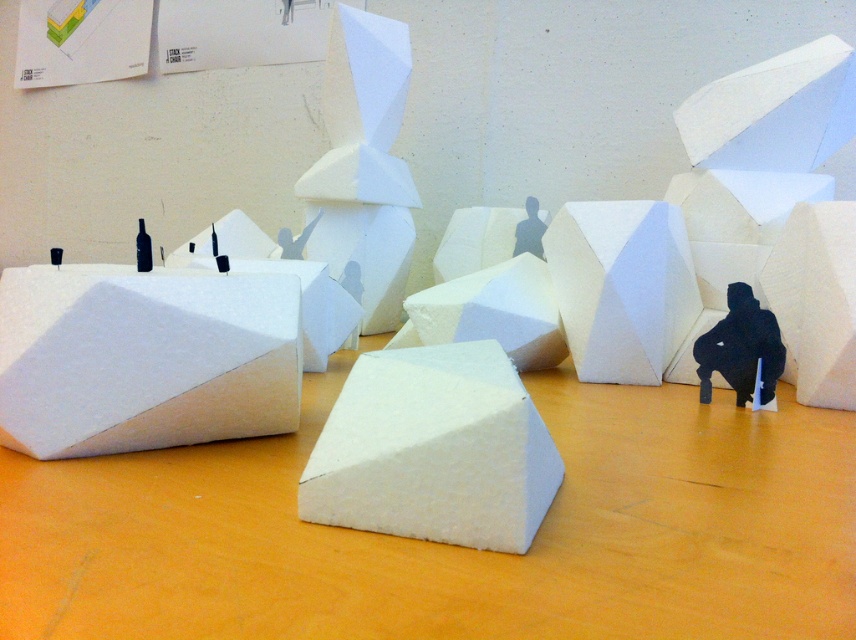
You are an artist trying to place a new small sculpture on the wooden surface. You have two options for placement spots near the white matte foam block at center and the white matte foam cube at lower right. Which spot has more space available for the sculpture?

The white matte foam block at center has a larger width than the white matte foam cube at lower right, so the area near the white matte foam block at center likely has more space available for the sculpture.

You are an architect designing a model and need to place a new block. The existing white matte foam block at center is located at point (432, 451). Where should you place the new block to ensure it is directly to the right of the existing one?

To place the new block directly to the right of the existing white matte foam block at center located at point (432, 451), you should position it at a point with a higher x coordinate, such as 0.75, 0.507. This ensures the new block is positioned to the right while maintaining the same y coordinate for alignment.